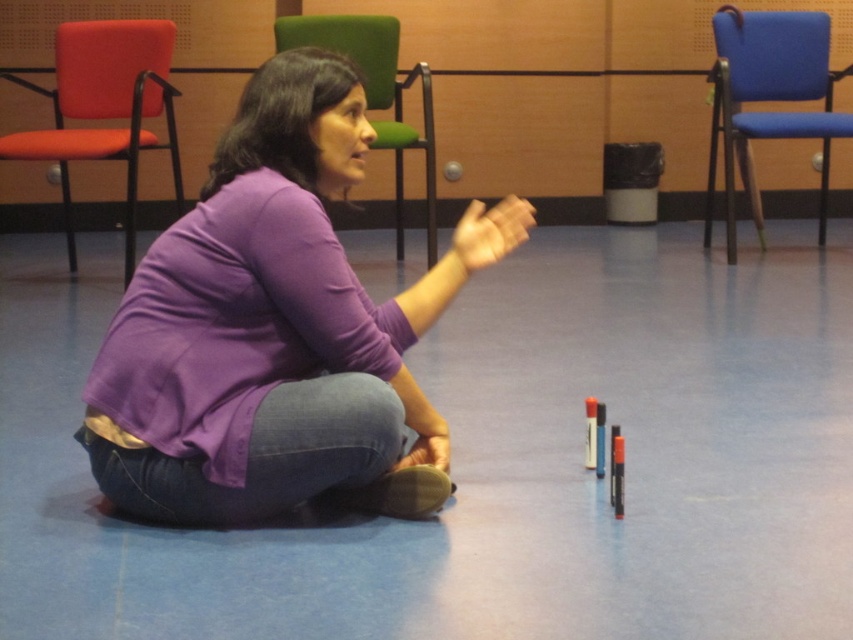
Between point (299, 310) and point (799, 65), which one is positioned behind?

The point (799, 65) is behind.

Is point (357, 419) positioned behind point (831, 93)?

That is False.

Does point (103, 388) come in front of point (706, 232)?

Yes, it is.

This screenshot has width=853, height=640. Find the location of `purple soft shirt at center`. purple soft shirt at center is located at coordinates pyautogui.click(x=276, y=330).

Does blue fabric chair at right appear on the left side of green fabric chair at upper center?

No, blue fabric chair at right is not to the left of green fabric chair at upper center.

Does blue fabric chair at right lie in front of green fabric chair at upper center?

No, blue fabric chair at right is behind green fabric chair at upper center.

Find the location of a particular element. blue fabric chair at right is located at coordinates (769, 96).

The width and height of the screenshot is (853, 640). What do you see at coordinates (103, 108) in the screenshot? I see `orange fabric chair at left` at bounding box center [103, 108].

Who is shorter, orange fabric chair at left or green fabric chair at upper center?

green fabric chair at upper center is shorter.

Is point (126, 164) closer to viewer compared to point (352, 33)?

No, (126, 164) is behind (352, 33).

I want to click on orange fabric chair at left, so click(x=103, y=108).